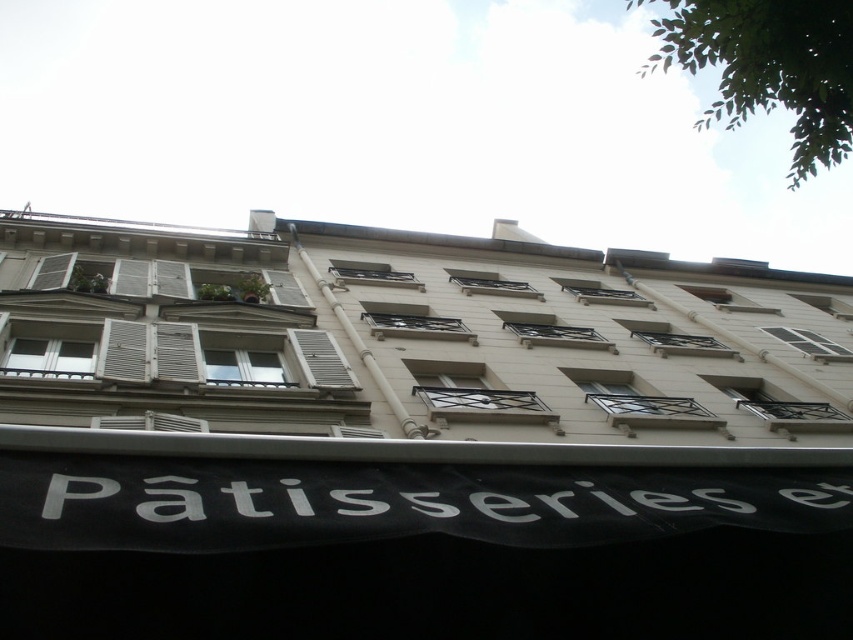
Who is taller, white wooden shutters at left or white wooden shutter at upper left?

With more height is white wooden shutter at upper left.

Is point (138, 342) positioned after point (45, 259)?

No, it is in front of (45, 259).

Between point (105, 323) and point (44, 284), which one is positioned behind?

Point (44, 284)

You are a GUI agent. You are given a task and a screenshot of the screen. Output one action in this format:
    pyautogui.click(x=<x>, y=<y>)
    Task: Click on the white wooden shutters at left
    The height and width of the screenshot is (640, 853).
    Given the screenshot: What is the action you would take?
    pyautogui.click(x=123, y=352)

Is white wooden shutters at left thinner than white matte shutter at center?

Indeed, white wooden shutters at left has a lesser width compared to white matte shutter at center.

Is the position of white wooden shutters at left less distant than that of white matte shutter at center?

No, it is behind white matte shutter at center.

Is point (108, 321) less distant than point (302, 353)?

No.

Locate an element on the screen. The width and height of the screenshot is (853, 640). white wooden shutters at left is located at coordinates (123, 352).

Can you confirm if white wooden shutters at left is positioned above white wooden shutter at center?

Incorrect, white wooden shutters at left is not positioned above white wooden shutter at center.

Can you confirm if white wooden shutters at left is positioned below white wooden shutter at center?

Yes, white wooden shutters at left is below white wooden shutter at center.

Where is `white wooden shutters at left`? The height and width of the screenshot is (640, 853). white wooden shutters at left is located at coordinates (123, 352).